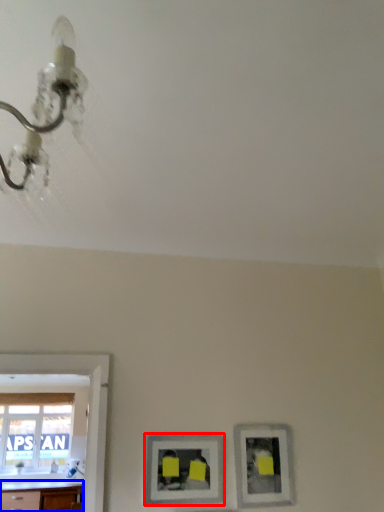
Question: Among these objects, which one is nearest to the camera, picture frame (highlighted by a red box) or counter top (highlighted by a blue box)?

Choices:
 (A) picture frame
 (B) counter top

Answer: (A)